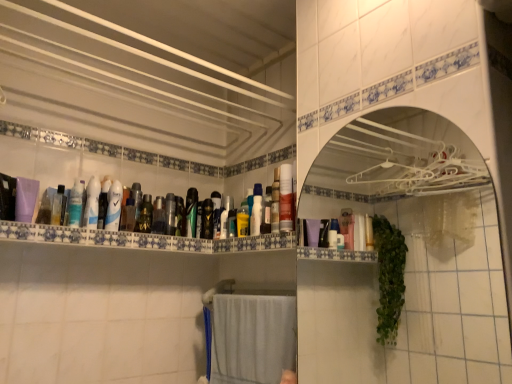
Question: In terms of size, does translucent plastic bottles at upper center appear bigger or smaller than yellow matte bottle at center, placed as the thirteenth mouthwash when sorted from left to right?

Choices:
 (A) small
 (B) big

Answer: (B)

Question: Considering their positions, is translucent plastic bottles at upper center located in front of or behind yellow matte bottle at center, which is the second mouthwash in right-to-left order?

Choices:
 (A) behind
 (B) front

Answer: (B)

Question: Which is nearer to the translucent plastic bottles at upper center?

Choices:
 (A) translucent plastic mouthwash at upper left, the first mouthwash positioned from the left
 (B) white glossy medicine cabinet at upper center
 (C) matte plastic spray can at center
 (D) green glossy mouthwash at center, which is the 10th mouthwash in left-to-right order
 (E) white glossy mouthwash at center, which ranks as the 12th mouthwash in right-to-left order

Answer: (E)

Question: Estimate the real-world distances between objects in this image. Which object is closer to the metallic silver mouthwash at center, acting as the 8th mouthwash starting from the left?

Choices:
 (A) metallic green mouthwash at center, marked as the 11th mouthwash in a left-to-right arrangement
 (B) translucent plastic mouthwash at upper left, the 14th mouthwash viewed from the right
 (C) matte plastic mouthwash at center, the first mouthwash viewed from the right
 (D) green matte bottle at center, the ninth mouthwash in the right-to-left sequence
 (E) white glossy mouthwash at center, which is the 3th mouthwash in left-to-right order

Answer: (D)